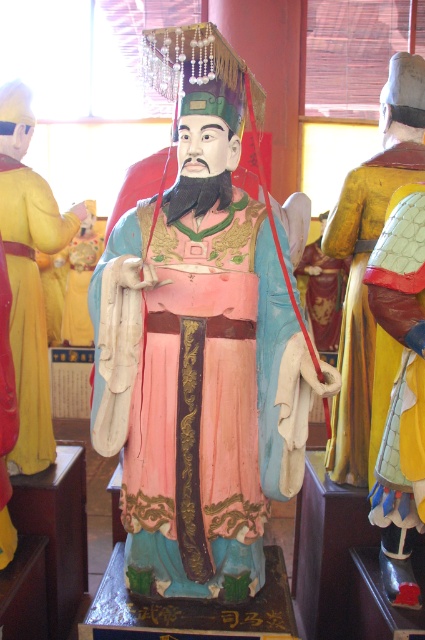
You are an art curator arranging an exhibition and need to place a new sculpture between the yellow textured armor at right and the matte yellow robe at left. Which side should you place it closer to if you want the sculpture to be smaller than both existing pieces?

The yellow textured armor at right is bigger than the matte yellow robe at left. To place the new sculpture smaller than both, it should be placed closer to the matte yellow robe at left since it is the smaller of the two.

You are an art curator examining the statues. Which statue is positioned lower in the display between the matte painted statue at center and the matte yellow robe at left?

The matte painted statue at center is located below the matte yellow robe at left, so it is positioned lower in the display.

In the scene shown: You are standing in front of the statues and want to take a photo of the matte painted statue at center. Your camera can focus on objects up to 2 meters away. Will the statue be in focus?

The matte painted statue at center is 2.06 meters away from camera, which is slightly beyond the camera focus limit of 2 meters. The statue will not be in focus.